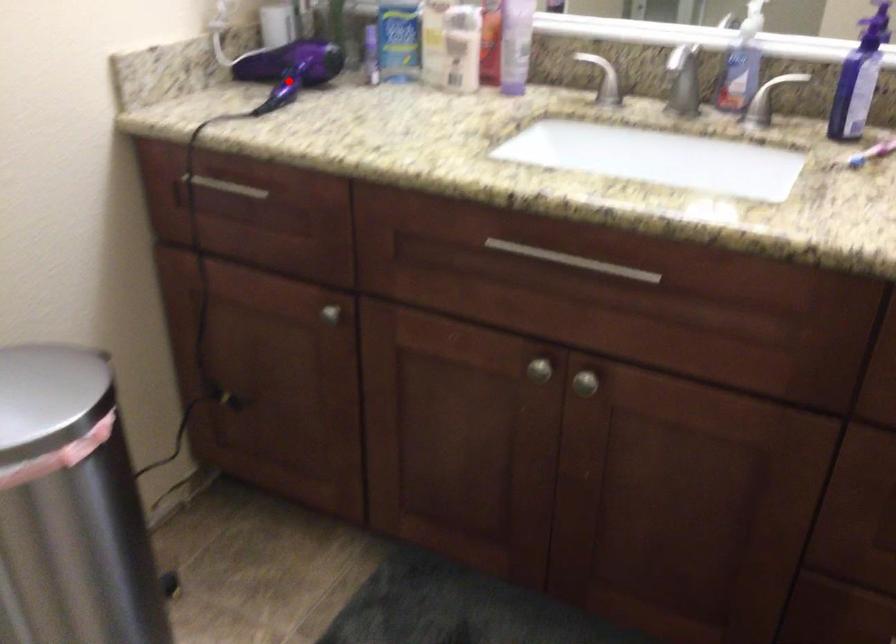
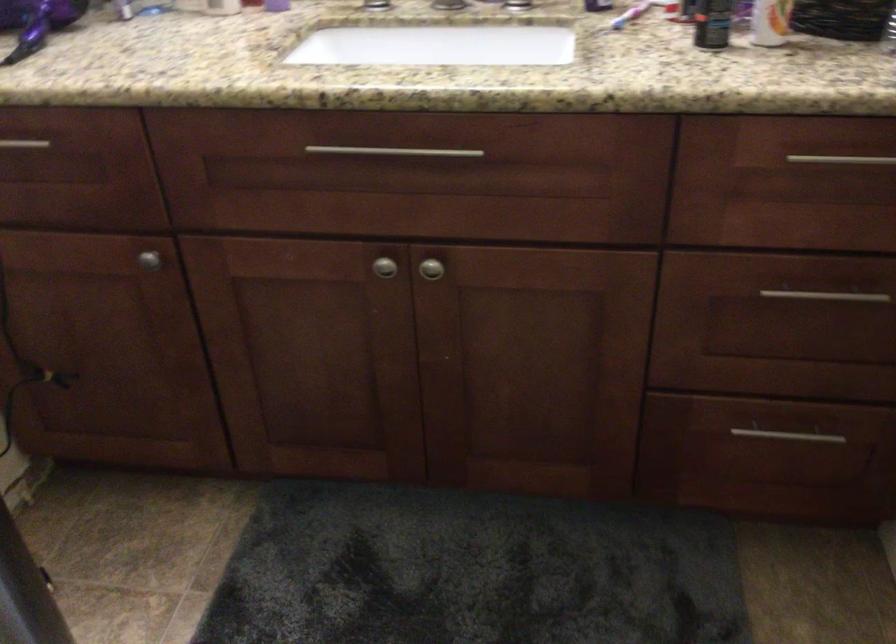
Where in the second image is the point corresponding to the highlighted location from the first image?

(37, 22)